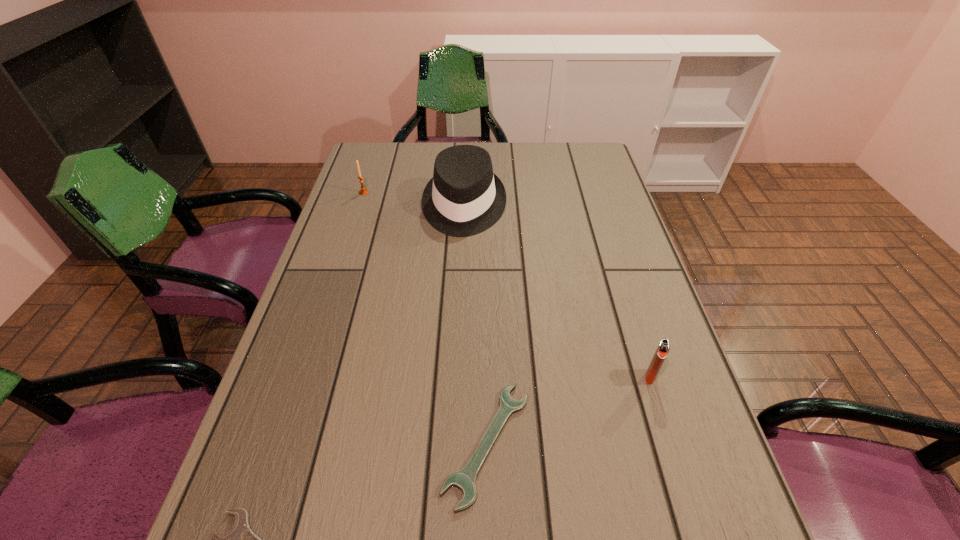
Find the location of a particular element. the tallest object is located at coordinates (464, 198).

Where is `candle_holder`? The image size is (960, 540). candle_holder is located at coordinates (363, 191).

The height and width of the screenshot is (540, 960). I want to click on igniter, so click(x=663, y=348).

Identify the location of the third farthest object. This screenshot has height=540, width=960. (663, 348).

The width and height of the screenshot is (960, 540). I want to click on the right wrench, so click(x=465, y=479).

In order to click on the fourth tallest object in this screenshot , I will do `click(465, 479)`.

Identify the location of blank space located on the front of the tallest object. The image size is (960, 540). (460, 295).

Locate an element on the screen. Image resolution: width=960 pixels, height=540 pixels. vacant area situated 0.320m on the right of the candle_holder is located at coordinates (470, 192).

Where is `vacant point located 0.280m on the left of the third farthest object`? vacant point located 0.280m on the left of the third farthest object is located at coordinates (509, 376).

Where is `free space located 0.290m on the back of the second shortest object`? The image size is (960, 540). free space located 0.290m on the back of the second shortest object is located at coordinates (485, 284).